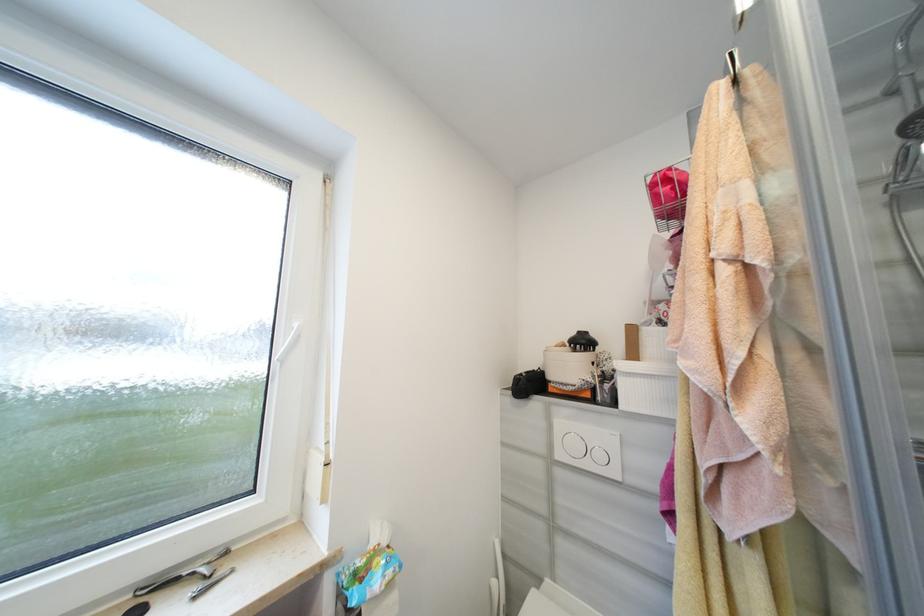
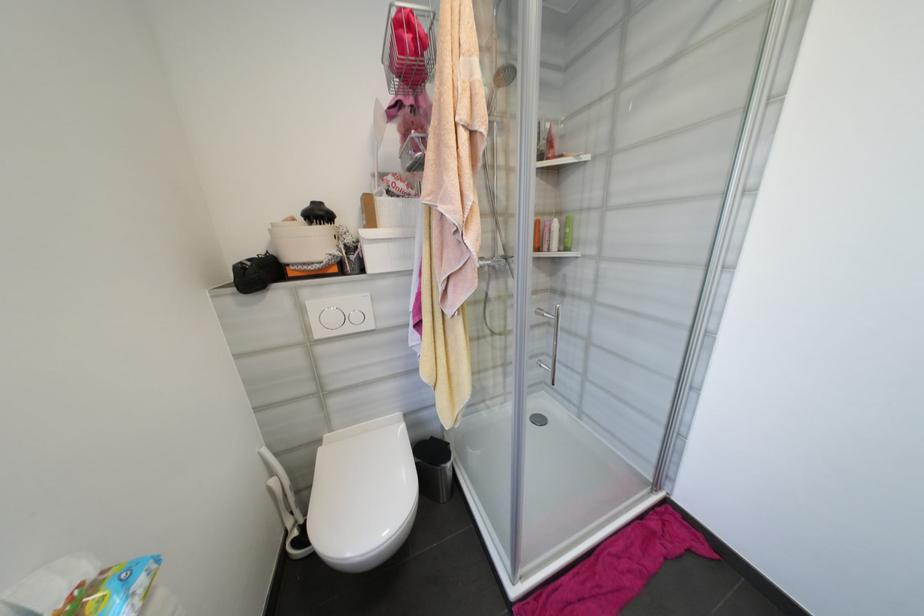
In the second image, find the point that corresponds to point 544,583 in the first image.

(325, 443)